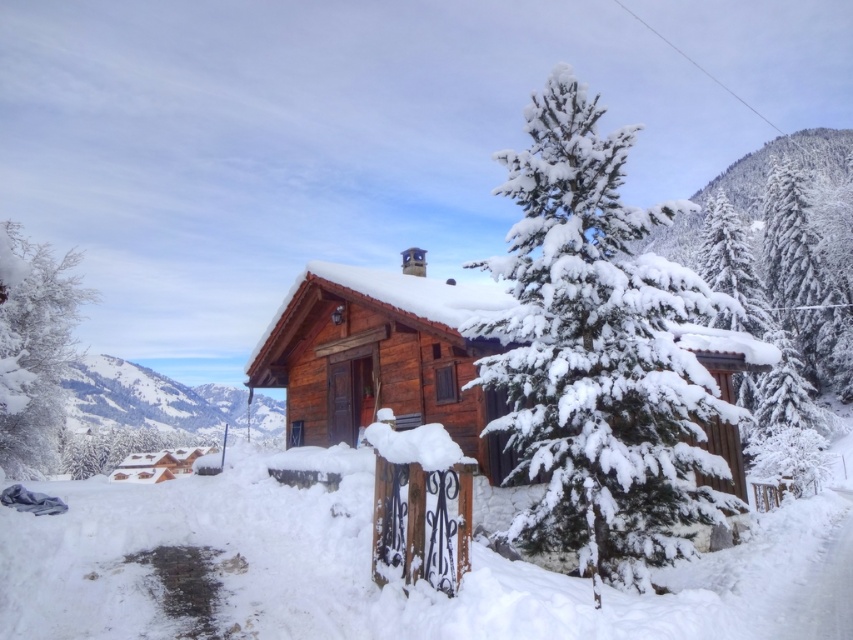
Question: Which point is closer to the camera?

Choices:
 (A) (845, 358)
 (B) (550, 196)

Answer: (B)

Question: Which point is closer to the camera?

Choices:
 (A) white frosty tree at left
 (B) snow-covered evergreen at upper right
 (C) snow-covered evergreen at center
 (D) snowy wooden mountain at upper left

Answer: (C)

Question: Does white frosty tree at left have a lesser width compared to snow-covered evergreen at upper right?

Choices:
 (A) yes
 (B) no

Answer: (B)

Question: Does snow-covered evergreen at center come in front of white frosty tree at left?

Choices:
 (A) yes
 (B) no

Answer: (A)

Question: Is snow-covered evergreen at center to the left of snow-covered evergreen at upper right from the viewer's perspective?

Choices:
 (A) yes
 (B) no

Answer: (A)

Question: Which object is closer to the camera taking this photo?

Choices:
 (A) snow-covered evergreen at center
 (B) snowy wooden mountain at upper left
 (C) snow-covered evergreen at upper right

Answer: (A)